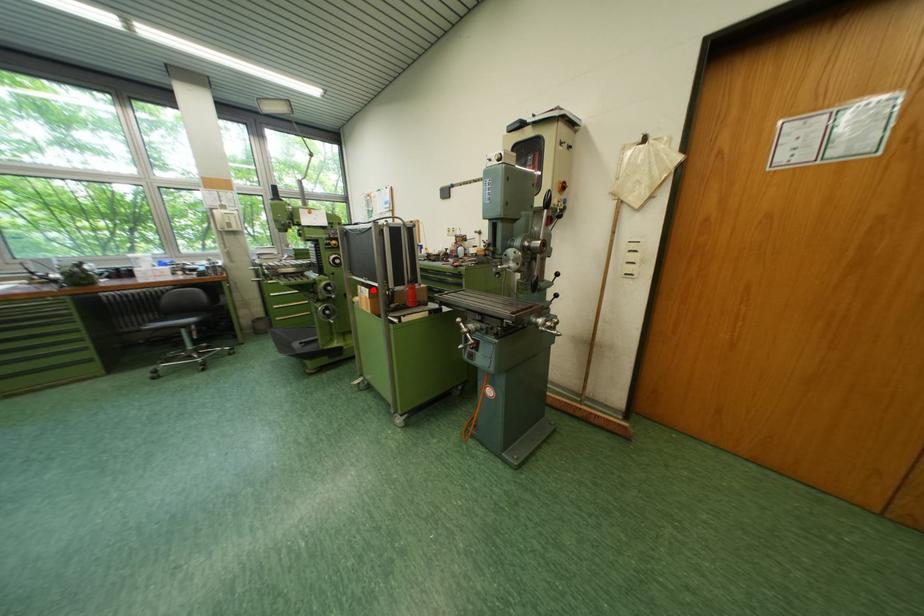
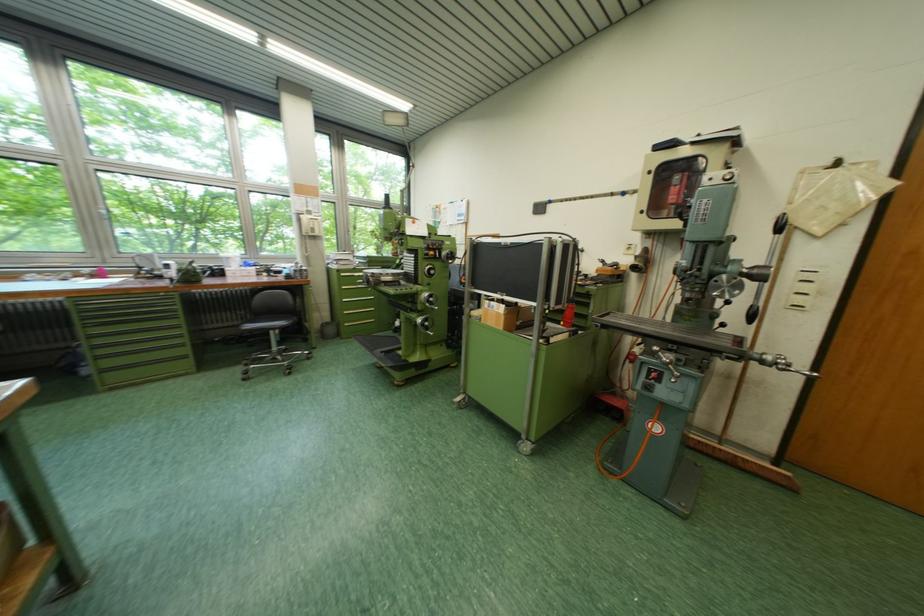
Where in the second image is the point corresponding to the highlighted location from the first image?

(503, 305)